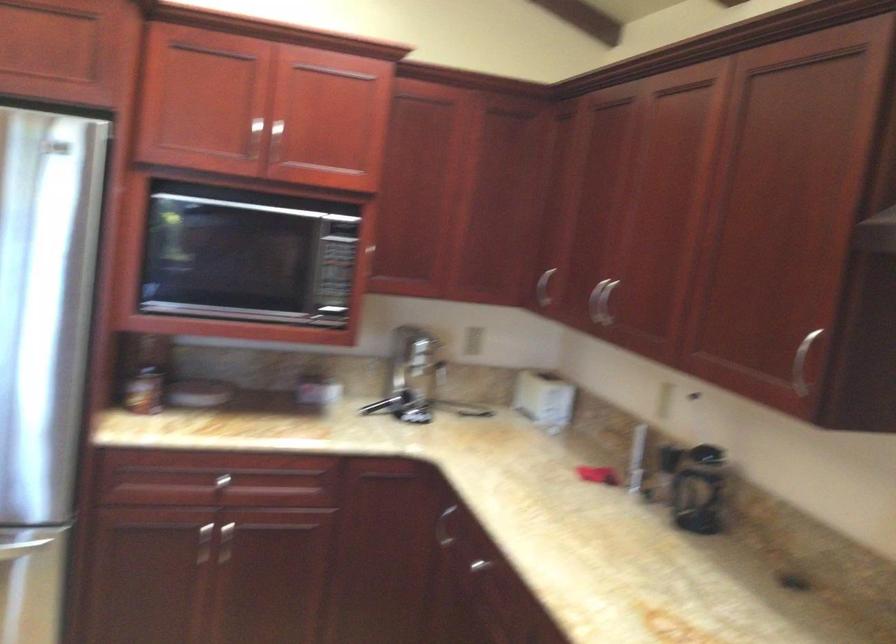
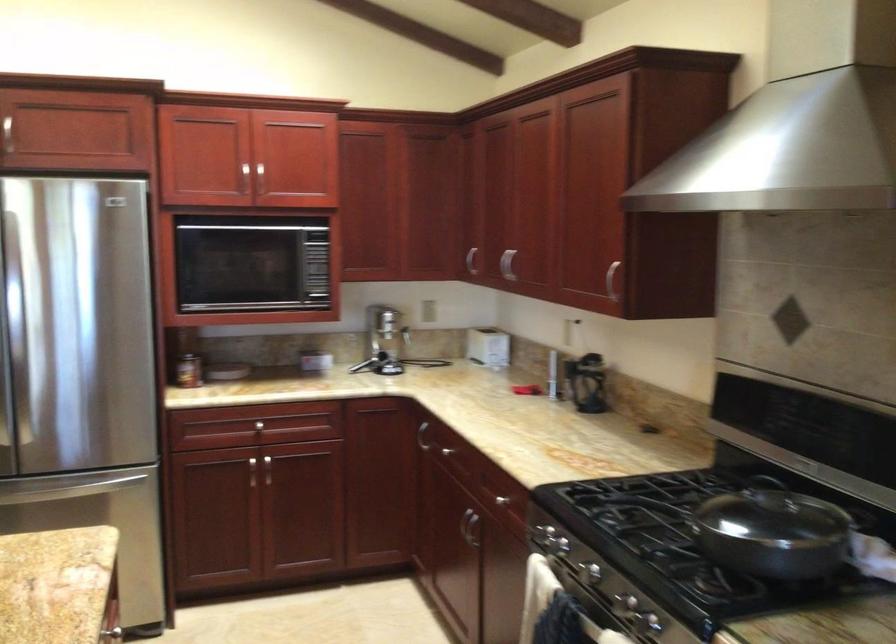
In the second image, find the point that corresponds to point 602,303 in the first image.

(506, 263)